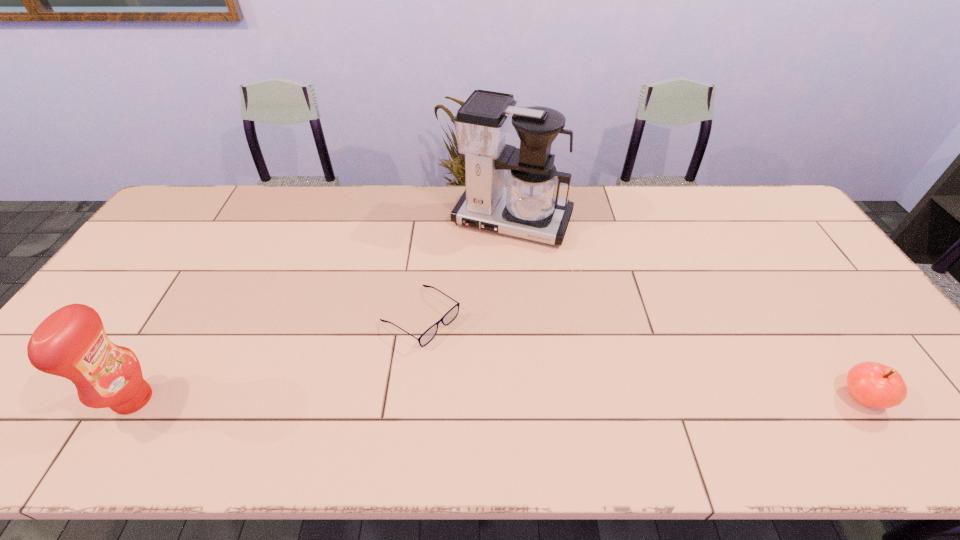
Where is `the leftmost object`? the leftmost object is located at coordinates (71, 342).

I want to click on condiment, so click(71, 342).

Locate an element on the screen. Image resolution: width=960 pixels, height=540 pixels. the third tallest object is located at coordinates (872, 384).

The image size is (960, 540). I want to click on apple, so click(x=872, y=384).

You are a GUI agent. You are given a task and a screenshot of the screen. Output one action in this format:
    pyautogui.click(x=<x>, y=<y>)
    Task: Click on the second farthest object
    The height and width of the screenshot is (540, 960).
    Given the screenshot: What is the action you would take?
    pyautogui.click(x=430, y=333)

At what (x,y) coordinates should I click in order to perform the action: click on the shortest object. Please return your answer as a coordinate pair (x, y). Looking at the image, I should click on (430, 333).

Identify the location of the farthest object. (529, 207).

Identify the location of coffee maker. (529, 207).

Locate an element on the screen. free spot located on the label side of the leftmost object is located at coordinates (277, 399).

Locate an element on the screen. free space located on the left of the rightmost object is located at coordinates (782, 397).